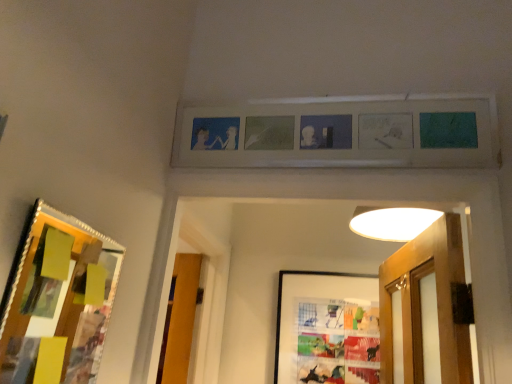
Question: Can you confirm if matte plastic picture frame at center, which ranks as the 1th picture frame in bottom-to-top order, is bigger than matte wooden picture frame at upper center, the second picture frame when ordered from front to back?

Choices:
 (A) no
 (B) yes

Answer: (A)

Question: Is matte plastic picture frame at center, which is the third picture frame from front to back, not within matte wooden picture frame at upper center, which ranks as the 2th picture frame in back-to-front order?

Choices:
 (A) no
 (B) yes

Answer: (B)

Question: Considering the relative sizes of matte plastic picture frame at center, the 3th picture frame positioned from the top, and matte wooden picture frame at upper center, the first picture frame in the top-to-bottom sequence, in the image provided, is matte plastic picture frame at center, the 3th picture frame positioned from the top, smaller than matte wooden picture frame at upper center, the first picture frame in the top-to-bottom sequence,?

Choices:
 (A) no
 (B) yes

Answer: (B)

Question: From the image's perspective, is matte plastic picture frame at center, the 3th picture frame positioned from the top, located beneath matte wooden picture frame at upper center, which is counted as the third picture frame, starting from the bottom?

Choices:
 (A) yes
 (B) no

Answer: (A)

Question: Is matte plastic picture frame at center, which is the third picture frame from front to back, not close to matte wooden picture frame at upper center, which is counted as the third picture frame, starting from the bottom?

Choices:
 (A) no
 (B) yes

Answer: (B)

Question: Looking at their shapes, would you say matte plastic picture frame at center, the 1th picture frame when ordered from back to front, is wider or thinner than wooden-framed collage at left, which is the 2th picture frame from top to bottom?

Choices:
 (A) wide
 (B) thin

Answer: (A)

Question: Does point (288, 372) appear closer or farther from the camera than point (68, 281)?

Choices:
 (A) closer
 (B) farther

Answer: (B)

Question: In the image, is matte plastic picture frame at center, which ranks as the 1th picture frame in bottom-to-top order, positioned in front of or behind wooden-framed collage at left, the 3th picture frame when ordered from back to front?

Choices:
 (A) behind
 (B) front

Answer: (A)

Question: Would you say matte plastic picture frame at center, the 1th picture frame when ordered from back to front, is to the left or to the right of wooden-framed collage at left, the 3th picture frame when ordered from back to front, in the picture?

Choices:
 (A) left
 (B) right

Answer: (B)

Question: In the image, is wooden-framed collage at left, which is the 2th picture frame from top to bottom, positioned in front of or behind matte plastic picture frame at center, which ranks as the 1th picture frame in bottom-to-top order?

Choices:
 (A) front
 (B) behind

Answer: (A)

Question: In terms of size, does wooden-framed collage at left, the 3th picture frame when ordered from back to front, appear bigger or smaller than matte plastic picture frame at center, which ranks as the 1th picture frame in bottom-to-top order?

Choices:
 (A) big
 (B) small

Answer: (B)

Question: Is wooden-framed collage at left, the 3th picture frame when ordered from back to front, taller or shorter than matte plastic picture frame at center, which ranks as the 1th picture frame in bottom-to-top order?

Choices:
 (A) short
 (B) tall

Answer: (A)

Question: Based on their positions, is wooden-framed collage at left, which is the 2th picture frame from top to bottom, located to the left or right of matte plastic picture frame at center, the 1th picture frame when ordered from back to front?

Choices:
 (A) right
 (B) left

Answer: (B)

Question: Looking at the image, does matte wooden picture frame at upper center, which is counted as the third picture frame, starting from the bottom, seem bigger or smaller compared to matte plastic picture frame at center, the 3th picture frame positioned from the top?

Choices:
 (A) big
 (B) small

Answer: (A)

Question: In terms of width, does matte wooden picture frame at upper center, which is counted as the third picture frame, starting from the bottom, look wider or thinner when compared to matte plastic picture frame at center, the 3th picture frame positioned from the top?

Choices:
 (A) thin
 (B) wide

Answer: (B)